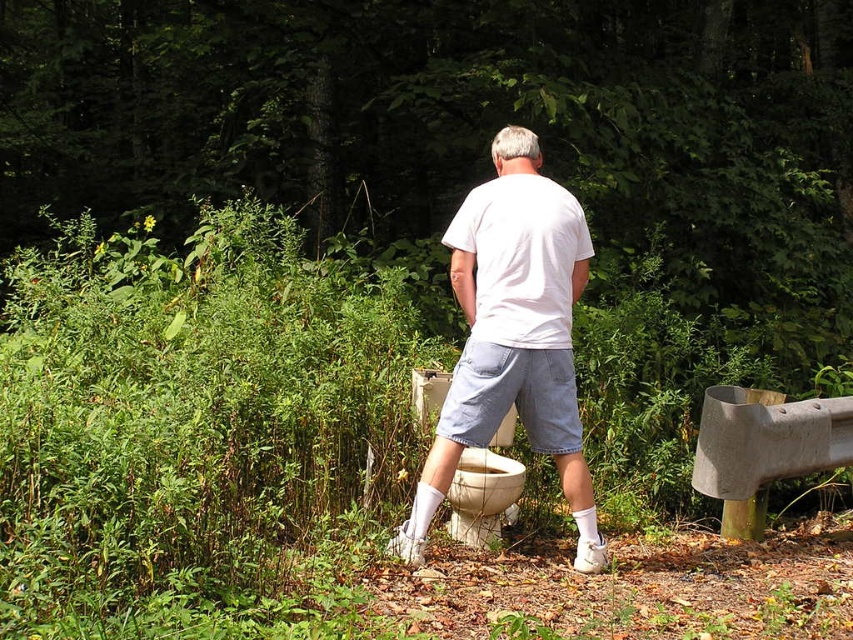
Question: Considering the relative positions of white cotton shirt at center and white glossy toilet bowl at lower center in the image provided, where is white cotton shirt at center located with respect to white glossy toilet bowl at lower center?

Choices:
 (A) left
 (B) right

Answer: (B)

Question: Which object appears closest to the camera in this image?

Choices:
 (A) concrete at right
 (B) white glossy toilet bowl at lower center
 (C) white cotton shirt at center

Answer: (C)

Question: Among these points, which one is nearest to the camera?

Choices:
 (A) (456, 497)
 (B) (461, 204)

Answer: (A)

Question: Can you confirm if white cotton shirt at center is positioned to the right of white glossy toilet bowl at lower center?

Choices:
 (A) no
 (B) yes

Answer: (B)

Question: Is the position of white cotton shirt at center less distant than that of white glossy toilet bowl at lower center?

Choices:
 (A) yes
 (B) no

Answer: (A)

Question: Which object appears farthest from the camera in this image?

Choices:
 (A) white cotton shirt at center
 (B) white glossy toilet bowl at lower center
 (C) concrete at right

Answer: (C)